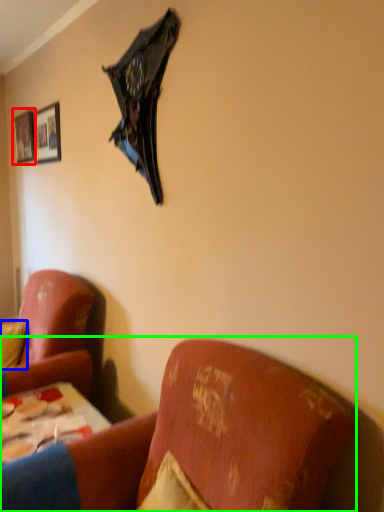
Question: Which object is the closest to the picture frame (highlighted by a red box)? Choose among these: pillow (highlighted by a blue box) or studio couch (highlighted by a green box).

Choices:
 (A) pillow
 (B) studio couch

Answer: (A)